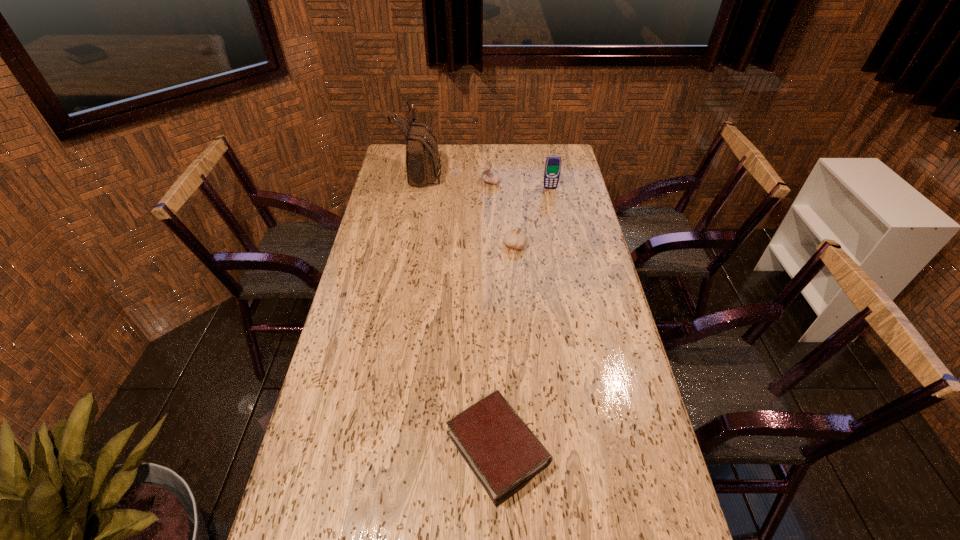
Find the location of a particular element. The height and width of the screenshot is (540, 960). vacant space located on the front-facing side of the leftmost object is located at coordinates (475, 172).

This screenshot has height=540, width=960. Identify the location of free location located on the front-facing side of the rightmost object. click(562, 244).

Image resolution: width=960 pixels, height=540 pixels. What are the coordinates of `vacant space situated on the back of the taller garlic` in the screenshot? It's located at (490, 150).

At what (x,y) coordinates should I click in order to perform the action: click on vacant space located on the right of the shorter garlic. Please return your answer as a coordinate pair (x, y). Image resolution: width=960 pixels, height=540 pixels. Looking at the image, I should click on (583, 245).

You are a GUI agent. You are given a task and a screenshot of the screen. Output one action in this format:
    pyautogui.click(x=<x>, y=<y>)
    Task: Click on the vacant point located on the back of the Bible
    The image size is (960, 540).
    Given the screenshot: What is the action you would take?
    pyautogui.click(x=493, y=310)

The height and width of the screenshot is (540, 960). Identify the location of object located at the far edge. (422, 156).

You are a GUI agent. You are given a task and a screenshot of the screen. Output one action in this format:
    pyautogui.click(x=<x>, y=<y>)
    Task: Click on the object at the left edge
    The image size is (960, 540).
    Given the screenshot: What is the action you would take?
    pyautogui.click(x=422, y=156)

Locate an element on the screen. object that is at the right edge is located at coordinates (552, 170).

Identify the location of object that is at the far left corner. (422, 156).

Identify the location of vacant space at the far edge of the desktop. Image resolution: width=960 pixels, height=540 pixels. (522, 170).